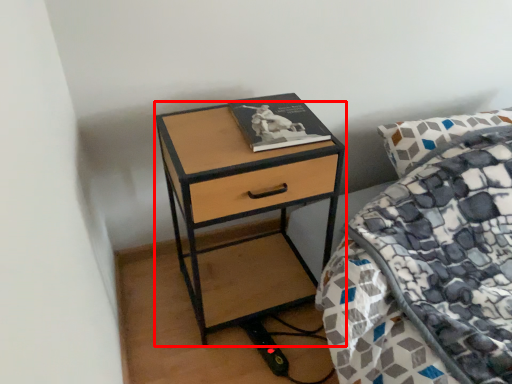
Question: From the image's perspective, where is nightstand (annotated by the red box) located in relation to book in the image?

Choices:
 (A) above
 (B) below

Answer: (B)